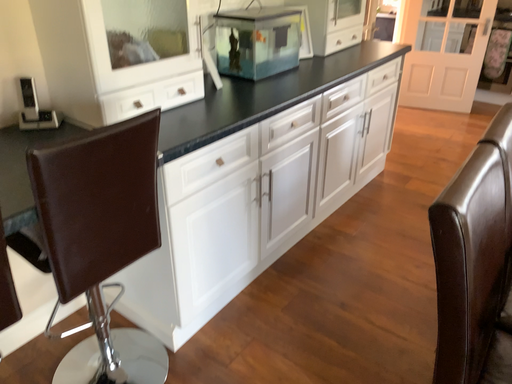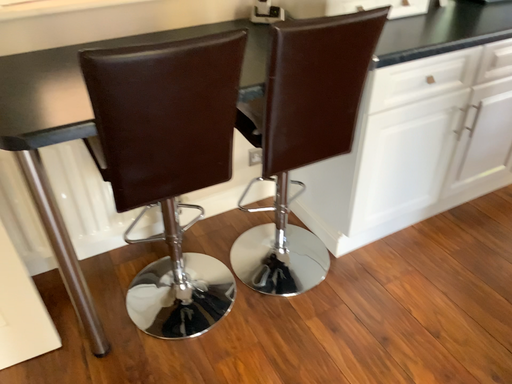
Question: Which way did the camera rotate in the video?

Choices:
 (A) rotated right
 (B) rotated left

Answer: (B)